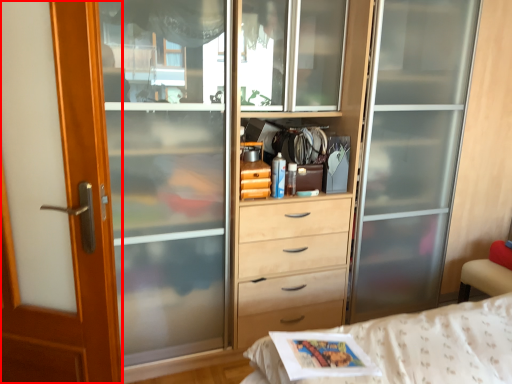
Question: In this image, where is screen door (annotated by the red box) located relative to magazine?

Choices:
 (A) right
 (B) left

Answer: (B)